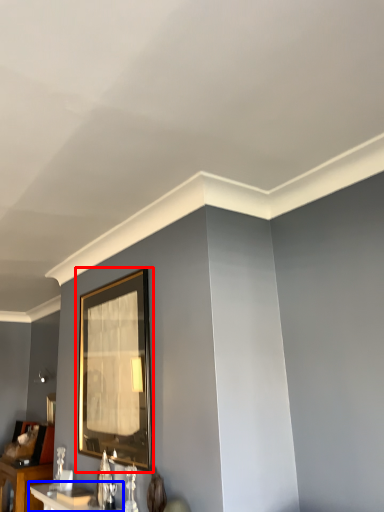
Question: Which object appears closest to the camera in this image, picture frame (highlighted by a red box) or table (highlighted by a blue box)?

Choices:
 (A) picture frame
 (B) table

Answer: (B)